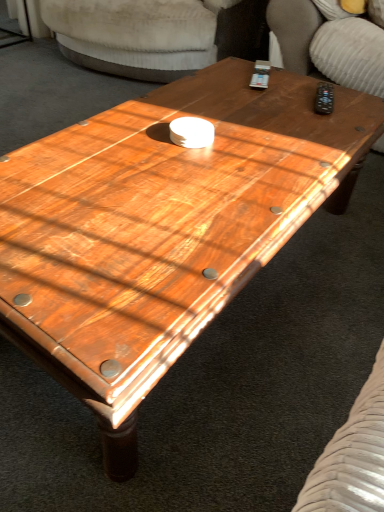
Question: Should I look upward or downward to see velvet beige armchair at upper center, the first armchair viewed from the left?

Choices:
 (A) down
 (B) up

Answer: (B)

Question: From a real-world perspective, is velvet beige armchair at upper center, the first armchair viewed from the left, over suede-like beige armchair at upper right, the second armchair from the left?

Choices:
 (A) yes
 (B) no

Answer: (B)

Question: Is velvet beige armchair at upper center, the first armchair viewed from the left, far from suede-like beige armchair at upper right, placed as the 1th armchair when sorted from right to left?

Choices:
 (A) yes
 (B) no

Answer: (B)

Question: Is suede-like beige armchair at upper right, placed as the 1th armchair when sorted from right to left, a part of velvet beige armchair at upper center, which ranks as the second armchair in right-to-left order?

Choices:
 (A) yes
 (B) no

Answer: (B)

Question: Is velvet beige armchair at upper center, which ranks as the second armchair in right-to-left order, turned away from suede-like beige armchair at upper right, placed as the 1th armchair when sorted from right to left?

Choices:
 (A) no
 (B) yes

Answer: (A)

Question: Is velvet beige armchair at upper center, the first armchair viewed from the left, aimed at suede-like beige armchair at upper right, placed as the 1th armchair when sorted from right to left?

Choices:
 (A) no
 (B) yes

Answer: (A)

Question: Is velvet beige armchair at upper center, the first armchair viewed from the left, shorter than suede-like beige armchair at upper right, the second armchair from the left?

Choices:
 (A) no
 (B) yes

Answer: (A)

Question: Is suede-like beige armchair at upper right, placed as the 1th armchair when sorted from right to left, closer to the viewer compared to velvet beige armchair at upper center, which ranks as the second armchair in right-to-left order?

Choices:
 (A) no
 (B) yes

Answer: (B)

Question: Is suede-like beige armchair at upper right, the second armchair from the left, oriented towards velvet beige armchair at upper center, the first armchair viewed from the left?

Choices:
 (A) no
 (B) yes

Answer: (A)

Question: From a real-world perspective, is suede-like beige armchair at upper right, placed as the 1th armchair when sorted from right to left, positioned over velvet beige armchair at upper center, the first armchair viewed from the left, based on gravity?

Choices:
 (A) yes
 (B) no

Answer: (A)

Question: Can you confirm if suede-like beige armchair at upper right, placed as the 1th armchair when sorted from right to left, is smaller than velvet beige armchair at upper center, the first armchair viewed from the left?

Choices:
 (A) yes
 (B) no

Answer: (A)

Question: Is suede-like beige armchair at upper right, placed as the 1th armchair when sorted from right to left, facing away from velvet beige armchair at upper center, which ranks as the second armchair in right-to-left order?

Choices:
 (A) no
 (B) yes

Answer: (A)

Question: From a real-world perspective, is suede-like beige armchair at upper right, placed as the 1th armchair when sorted from right to left, physically below velvet beige armchair at upper center, which ranks as the second armchair in right-to-left order?

Choices:
 (A) no
 (B) yes

Answer: (A)

Question: Is suede-like beige armchair at upper right, placed as the 1th armchair when sorted from right to left, bigger or smaller than velvet beige armchair at upper center, which ranks as the second armchair in right-to-left order?

Choices:
 (A) small
 (B) big

Answer: (A)